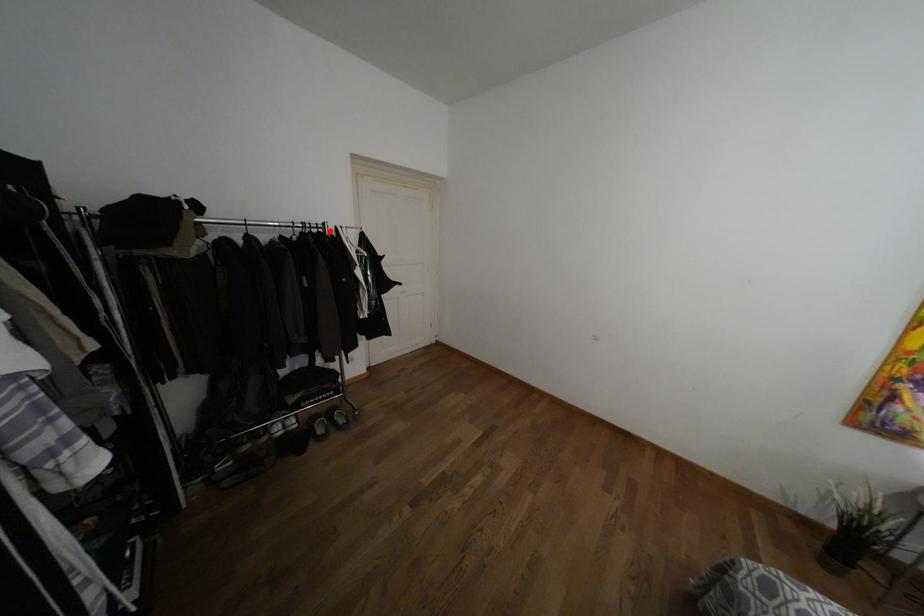
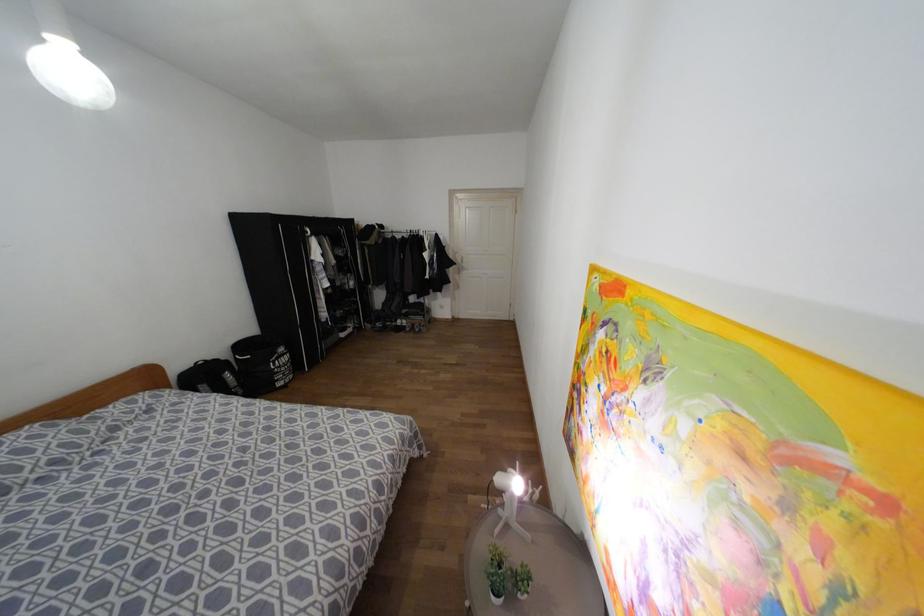
Question: I am providing you with two images of the same scene from different viewpoints. In image1, a red point is highlighted. Considering the same 3D point in image2, which of the following is correct?

Choices:
 (A) It is closer
 (B) It is farther

Answer: (A)